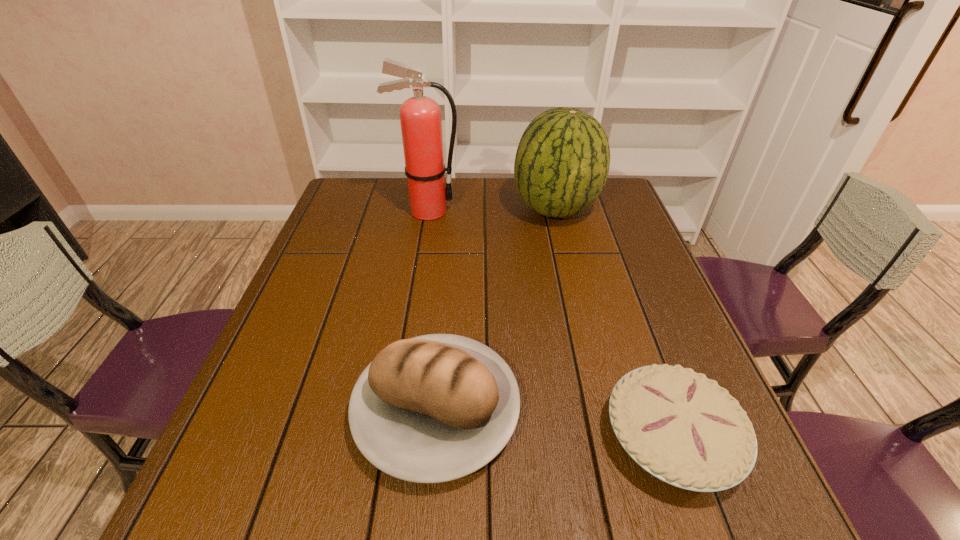
Where is `the tallest object`? the tallest object is located at coordinates (420, 117).

Where is `the third shortest object`? the third shortest object is located at coordinates (562, 161).

Locate an element on the screen. The width and height of the screenshot is (960, 540). the second shortest object is located at coordinates (433, 408).

I want to click on pie, so click(x=684, y=429).

Where is `vacant space positioned 0.080m on the hose direction of the fire extinguisher`? The image size is (960, 540). vacant space positioned 0.080m on the hose direction of the fire extinguisher is located at coordinates (487, 211).

Locate an element on the screen. This screenshot has width=960, height=540. blank area located 0.070m on the back of the watermelon is located at coordinates (548, 177).

This screenshot has width=960, height=540. I want to click on vacant point located 0.050m on the front of the second shortest object, so point(426,528).

This screenshot has width=960, height=540. In order to click on vacant region located 0.050m on the left of the pie in this screenshot , I will do `click(577, 437)`.

Where is `fire extinguisher situated at the far edge`? fire extinguisher situated at the far edge is located at coordinates tap(420, 117).

Locate an element on the screen. This screenshot has height=540, width=960. watermelon at the far edge is located at coordinates (562, 161).